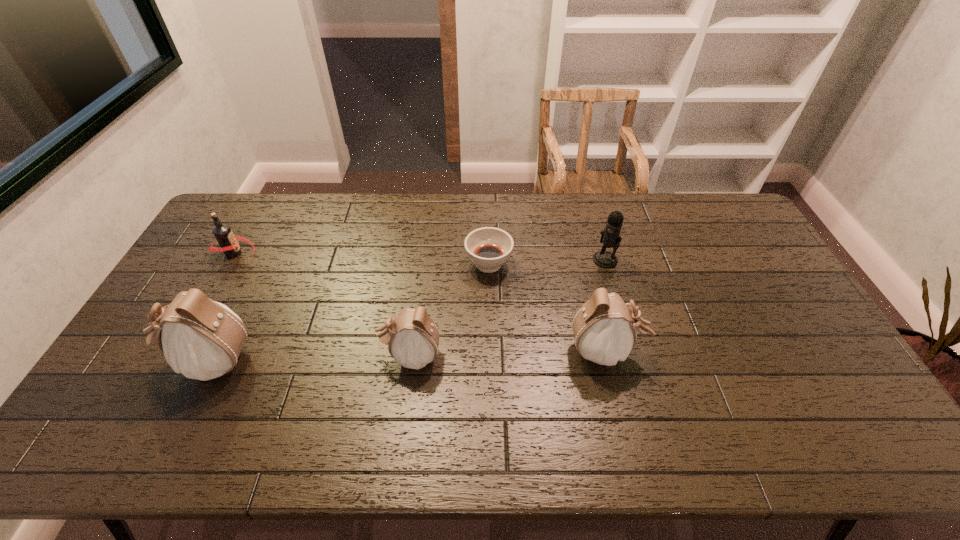
The image size is (960, 540). In order to click on the leftmost pouch in this screenshot , I will do `click(202, 339)`.

Where is `the third object from left to right`? The height and width of the screenshot is (540, 960). the third object from left to right is located at coordinates (412, 337).

At what (x,y) coordinates should I click in order to perform the action: click on the shortest pouch. Please return your answer as a coordinate pair (x, y). The width and height of the screenshot is (960, 540). Looking at the image, I should click on (412, 337).

The height and width of the screenshot is (540, 960). In order to click on the rightmost pouch in this screenshot , I will do `click(604, 330)`.

I want to click on microphone, so click(610, 237).

Find the location of a particular element. This screenshot has width=960, height=540. soup bowl is located at coordinates (488, 248).

Identify the location of the fourth object from left to right. The height and width of the screenshot is (540, 960). (488, 248).

Find the location of a particular element. root beer is located at coordinates (228, 242).

I want to click on vacant area situated 0.050m on the front-facing side of the leftmost pouch, so click(x=149, y=361).

Locate an element on the screen. This screenshot has width=960, height=540. free location located on the front-facing side of the leftmost pouch is located at coordinates (127, 361).